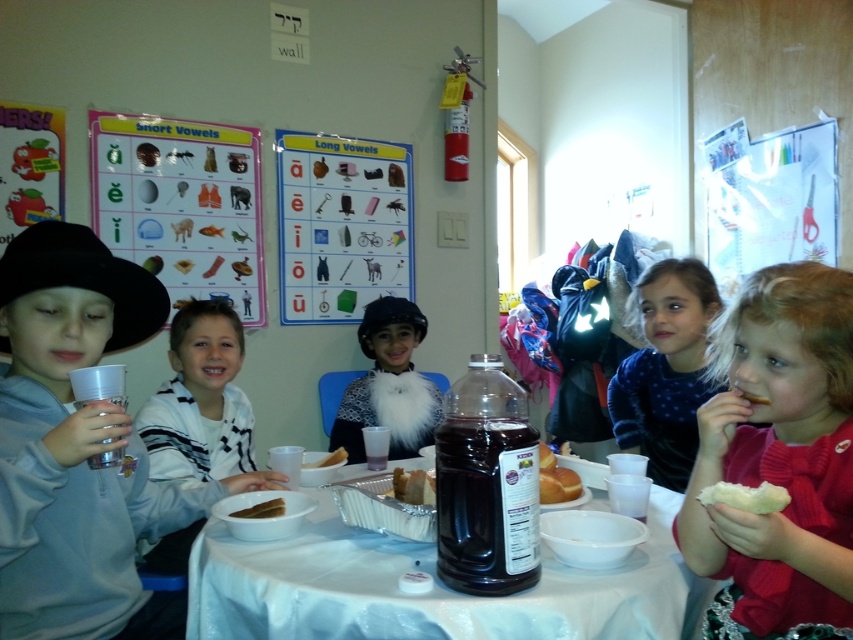
Question: Can you confirm if gray fleece jacket at left is wider than cardboard poster at center?

Choices:
 (A) no
 (B) yes

Answer: (A)

Question: Is the position of paperboard poster at upper center more distant than that of white fluffy bread at lower right?

Choices:
 (A) no
 (B) yes

Answer: (B)

Question: Is dark purple liquid at center to the left of brown paper bag at center from the viewer's perspective?

Choices:
 (A) no
 (B) yes

Answer: (A)

Question: Estimate the real-world distances between objects in this image. Which object is farther from the golden brown bread at center?

Choices:
 (A) blue velvet dress at center
 (B) brown paper bag at center
 (C) white striped shirt at center

Answer: (C)

Question: Which point is farther to the camera?

Choices:
 (A) cardboard poster at center
 (B) dark purple liquid at center
 (C) golden brown bread at center
 (D) white plastic table at center

Answer: (A)

Question: Which of the following is the farthest from the observer?

Choices:
 (A) white plastic table at center
 (B) white fluffy bread at lower right
 (C) brown bread at lower right

Answer: (C)